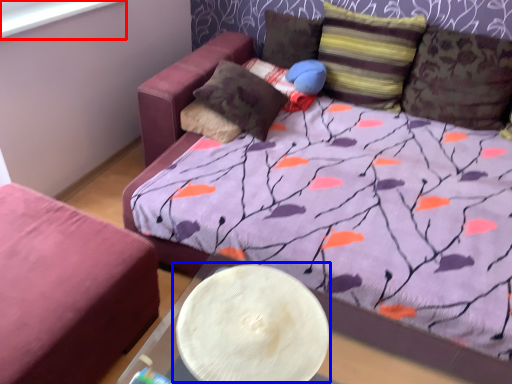
Question: Which point is further to the camera, window screen (highlighted by a red box) or round table (highlighted by a blue box)?

Choices:
 (A) window screen
 (B) round table

Answer: (A)